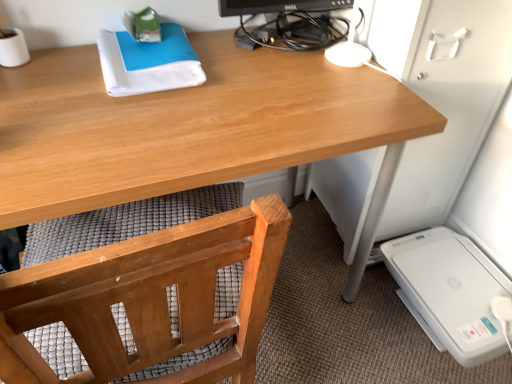
Question: Based on their positions, is white plastic printer at lower right located to the left or right of wooden desk at center?

Choices:
 (A) left
 (B) right

Answer: (B)

Question: In terms of height, does white plastic printer at lower right look taller or shorter compared to wooden desk at center?

Choices:
 (A) short
 (B) tall

Answer: (A)

Question: Which is farther from the wooden chair at lower left?

Choices:
 (A) black glossy monitor at upper center
 (B) white plastic printer at lower right
 (C) wooden desk at center

Answer: (B)

Question: Considering the real-world distances, which object is closest to the wooden desk at center?

Choices:
 (A) black glossy monitor at upper center
 (B) wooden chair at lower left
 (C) white plastic printer at lower right

Answer: (A)